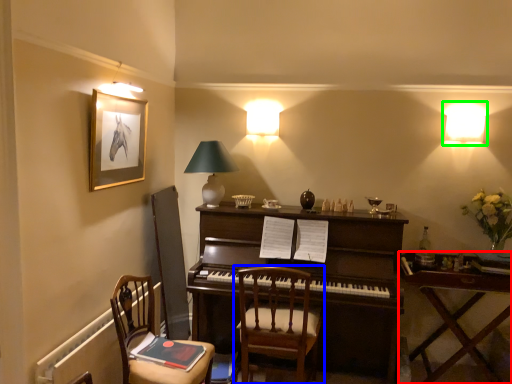
Question: Which object is positioned closest to table (highlighted by a red box)? Select from chair (highlighted by a blue box) and lamp (highlighted by a green box).

Choices:
 (A) chair
 (B) lamp

Answer: (A)